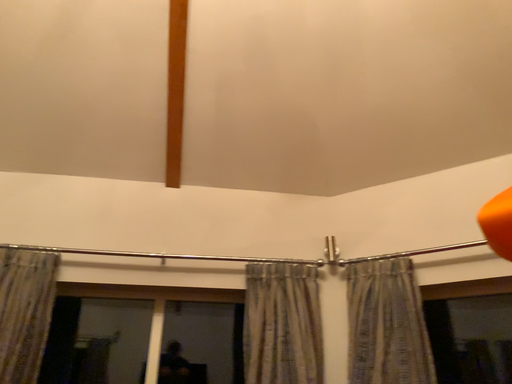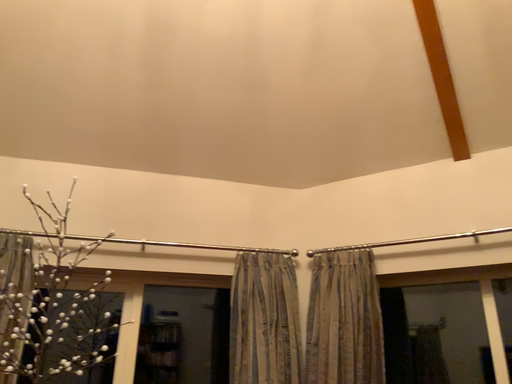
Question: Which way did the camera rotate in the video?

Choices:
 (A) rotated downward
 (B) rotated upward

Answer: (A)